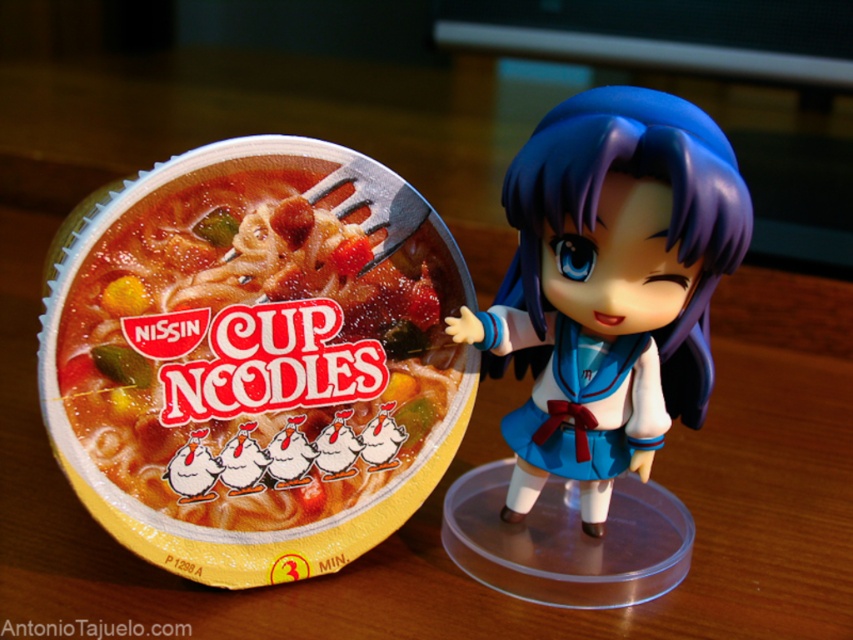
Image resolution: width=853 pixels, height=640 pixels. What do you see at coordinates (257, 346) in the screenshot? I see `matte plastic cup noodles at left` at bounding box center [257, 346].

Can you confirm if matte plastic cup noodles at left is taller than satin blue doll at center?

In fact, matte plastic cup noodles at left may be shorter than satin blue doll at center.

Who is more distant from viewer, (283, 356) or (555, 280)?

Positioned behind is point (283, 356).

Where is `matte plastic cup noodles at left`? The image size is (853, 640). matte plastic cup noodles at left is located at coordinates tap(257, 346).